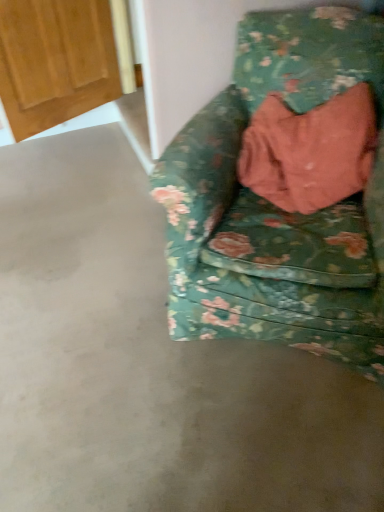
Describe the element at coordinates (55, 61) in the screenshot. The width and height of the screenshot is (384, 512). I see `wooden door at upper left` at that location.

I want to click on wooden door at upper left, so click(55, 61).

The height and width of the screenshot is (512, 384). I want to click on floral fabric chair at right, so click(x=277, y=207).

What do you see at coordinates (277, 207) in the screenshot? The height and width of the screenshot is (512, 384). I see `floral fabric chair at right` at bounding box center [277, 207].

The height and width of the screenshot is (512, 384). I want to click on wooden door at upper left, so click(x=55, y=61).

Is wooden door at upper left to the left of floral fabric chair at right from the viewer's perspective?

Correct, you'll find wooden door at upper left to the left of floral fabric chair at right.

In the image, is wooden door at upper left positioned in front of or behind floral fabric chair at right?

In the image, wooden door at upper left appears behind floral fabric chair at right.

Does point (84, 0) appear closer or farther from the camera than point (352, 351)?

Point (84, 0).

From the image's perspective, is wooden door at upper left above or below floral fabric chair at right?

From the image's perspective, wooden door at upper left appears above floral fabric chair at right.

From a real-world perspective, is wooden door at upper left above or below floral fabric chair at right?

wooden door at upper left is above floral fabric chair at right.

Considering the sizes of wooden door at upper left and floral fabric chair at right in the image, is wooden door at upper left wider or thinner than floral fabric chair at right?

In the image, wooden door at upper left appears to be more narrow than floral fabric chair at right.

Can you confirm if wooden door at upper left is taller than floral fabric chair at right?

No, wooden door at upper left is not taller than floral fabric chair at right.

Which of these two, wooden door at upper left or floral fabric chair at right, is smaller?

wooden door at upper left is smaller.

Is wooden door at upper left situated inside floral fabric chair at right or outside?

wooden door at upper left cannot be found inside floral fabric chair at right.

Can you see wooden door at upper left touching floral fabric chair at right?

No, wooden door at upper left is not beside floral fabric chair at right.

Is wooden door at upper left oriented towards floral fabric chair at right?

Yes, wooden door at upper left is facing floral fabric chair at right.

How many degrees apart are the facing directions of wooden door at upper left and floral fabric chair at right?

There is a 62.8-degree angle between the facing directions of wooden door at upper left and floral fabric chair at right.

How much distance is there between wooden door at upper left and floral fabric chair at right?

wooden door at upper left is 4.10 feet away from floral fabric chair at right.

You are a GUI agent. You are given a task and a screenshot of the screen. Output one action in this format:
    pyautogui.click(x=<x>, y=<y>)
    Task: Click on the door lying above the floral fabric chair at right (from the image's perspective)
    The height and width of the screenshot is (512, 384).
    Given the screenshot: What is the action you would take?
    [55, 61]

Can you confirm if floral fabric chair at right is positioned to the left of wooden door at upper left?

Incorrect, floral fabric chair at right is not on the left side of wooden door at upper left.

Considering the relative positions of floral fabric chair at right and wooden door at upper left in the image provided, is floral fabric chair at right behind wooden door at upper left?

No, floral fabric chair at right is closer to the camera.

Which point is more forward, (x=361, y=221) or (x=66, y=101)?

The point (x=361, y=221) is closer.

From the image's perspective, relative to wooden door at upper left, is floral fabric chair at right above or below?

Clearly, from the image's perspective, floral fabric chair at right is below wooden door at upper left.

From a real-world perspective, which is physically below, floral fabric chair at right or wooden door at upper left?

floral fabric chair at right, from a real-world perspective.

Looking at this image, can you confirm if floral fabric chair at right is wider than wooden door at upper left?

Yes.

From the picture: Considering the relative sizes of floral fabric chair at right and wooden door at upper left in the image provided, is floral fabric chair at right shorter than wooden door at upper left?

No, floral fabric chair at right is not shorter than wooden door at upper left.

Can you confirm if floral fabric chair at right is smaller than wooden door at upper left?

No.

Is floral fabric chair at right completely or partially outside of wooden door at upper left?

Yes, floral fabric chair at right is not within wooden door at upper left.

Are floral fabric chair at right and wooden door at upper left located far from each other?

Yes, floral fabric chair at right and wooden door at upper left are located far from each other.

Is floral fabric chair at right turned away from wooden door at upper left?

No, floral fabric chair at right is not facing the opposite direction of wooden door at upper left.

How different are the orientations of floral fabric chair at right and wooden door at upper left in degrees?

There is a 62.8-degree angle between the facing directions of floral fabric chair at right and wooden door at upper left.

How distant is floral fabric chair at right from wooden door at upper left?

floral fabric chair at right is 1.25 meters away from wooden door at upper left.

At what (x,y) coordinates should I click in order to perform the action: click on door above the floral fabric chair at right (from a real-world perspective). Please return your answer as a coordinate pair (x, y). The height and width of the screenshot is (512, 384). Looking at the image, I should click on (55, 61).

At what (x,y) coordinates should I click in order to perform the action: click on door above the floral fabric chair at right (from the image's perspective). Please return your answer as a coordinate pair (x, y). The image size is (384, 512). Looking at the image, I should click on (55, 61).

Find the location of a particular element. The image size is (384, 512). door above the floral fabric chair at right (from a real-world perspective) is located at coordinates (55, 61).